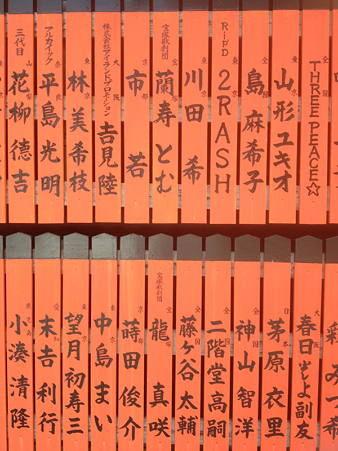
Where is `decoration`? The image size is (338, 451). decoration is located at coordinates (227, 72).